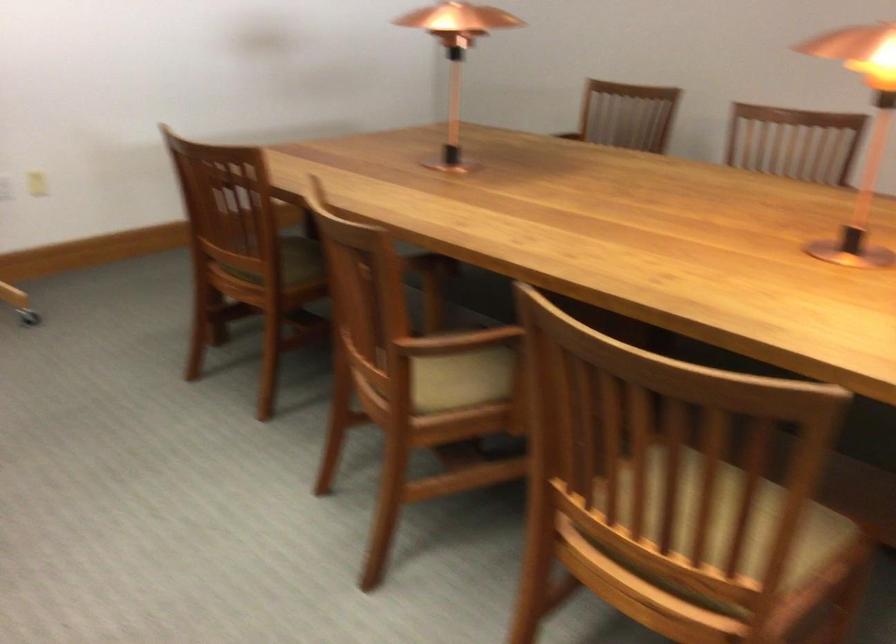
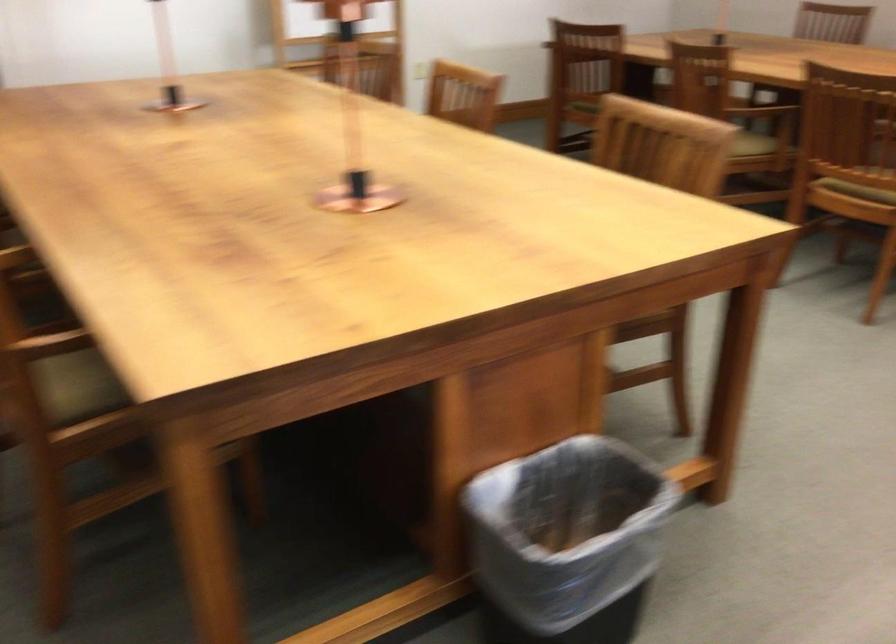
Question: The images are taken continuously from a first-person perspective. In which direction are you moving?

Choices:
 (A) Left
 (B) Right
 (C) Forward
 (D) Backward

Answer: (D)